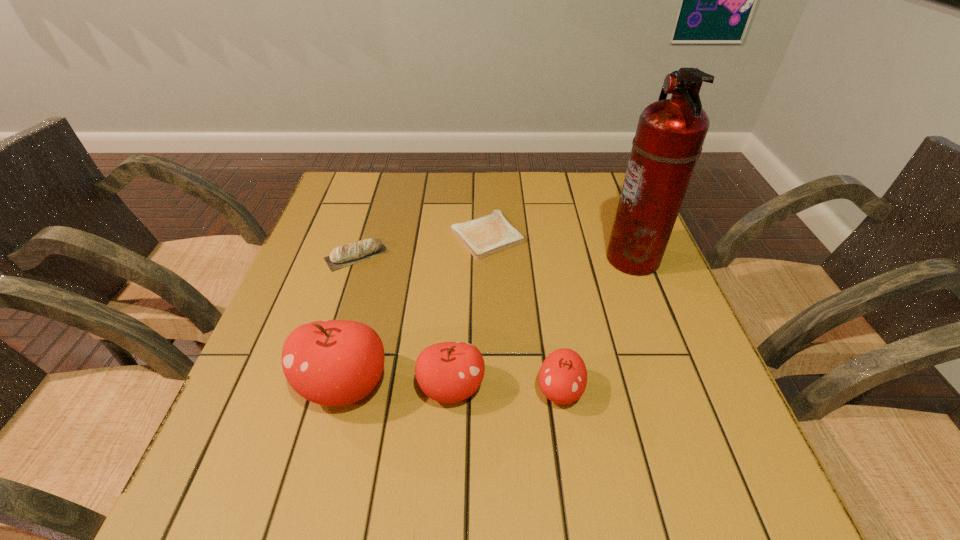
Identify the location of the tallest apple. (331, 362).

I want to click on the second tallest object, so click(x=331, y=362).

The height and width of the screenshot is (540, 960). I want to click on the third tallest object, so click(448, 372).

The height and width of the screenshot is (540, 960). I want to click on the second shortest apple, so click(448, 372).

You are a GUI agent. You are given a task and a screenshot of the screen. Output one action in this format:
    pyautogui.click(x=<x>, y=<y>)
    Task: Click on the fourth tallest object
    This screenshot has height=540, width=960.
    Given the screenshot: What is the action you would take?
    pyautogui.click(x=563, y=376)

The height and width of the screenshot is (540, 960). In order to click on the shortest apple in this screenshot , I will do `click(563, 376)`.

The image size is (960, 540). In order to click on the shortest object in this screenshot , I will do `click(492, 233)`.

Identify the location of the fifth tallest object. The height and width of the screenshot is (540, 960). click(x=341, y=256).

This screenshot has height=540, width=960. I want to click on fire extinguisher, so click(670, 134).

Image resolution: width=960 pixels, height=540 pixels. I want to click on the rightmost object, so click(670, 134).